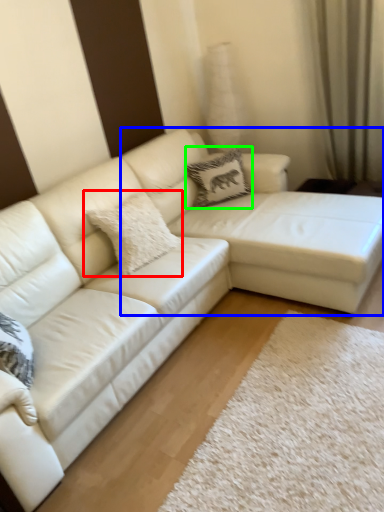
Question: Estimate the real-world distances between objects in this image. Which object is farther from pillow (highlighted by a red box), couch (highlighted by a blue box) or pillow (highlighted by a green box)?

Choices:
 (A) couch
 (B) pillow

Answer: (B)